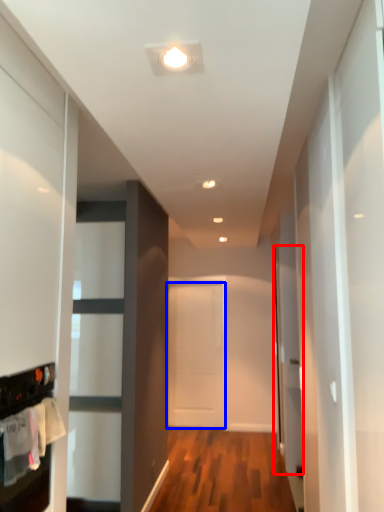
Question: Which object is closer to the camera taking this photo, glass door (highlighted by a red box) or door (highlighted by a blue box)?

Choices:
 (A) glass door
 (B) door

Answer: (A)